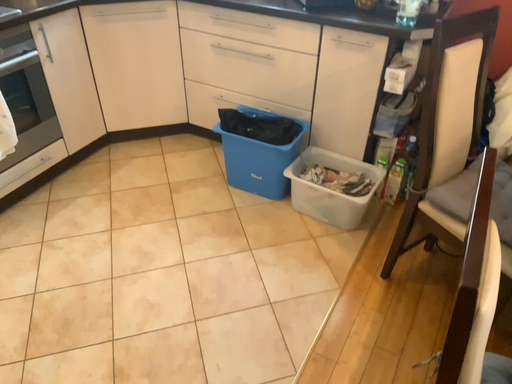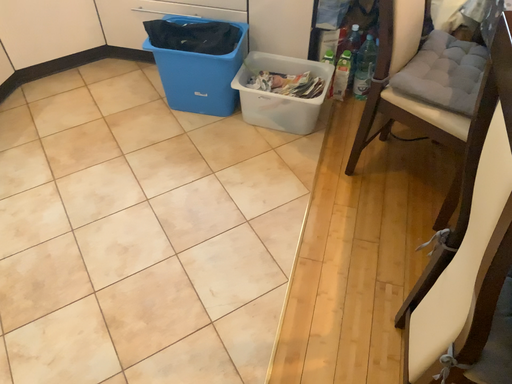
Question: Which way did the camera rotate in the video?

Choices:
 (A) rotated left
 (B) rotated right

Answer: (B)